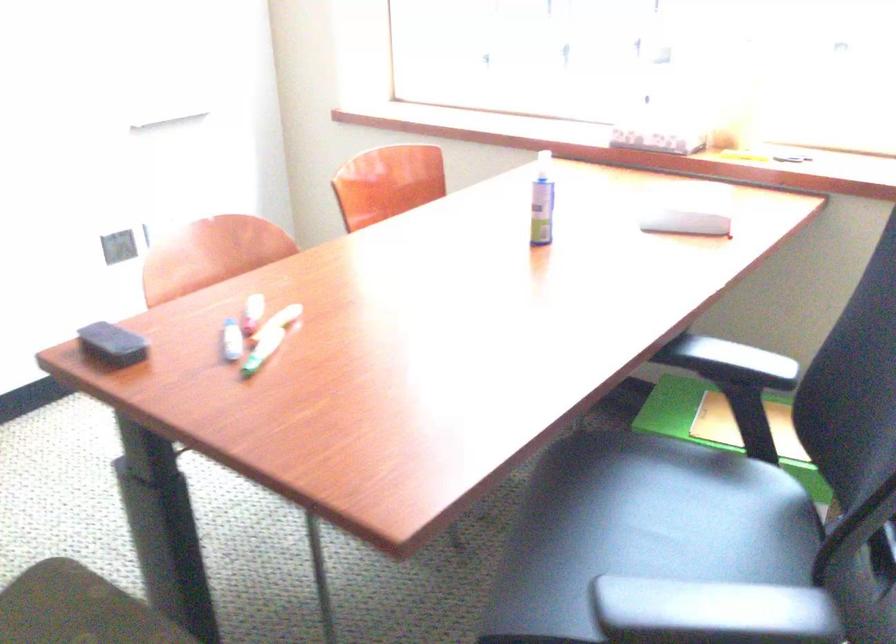
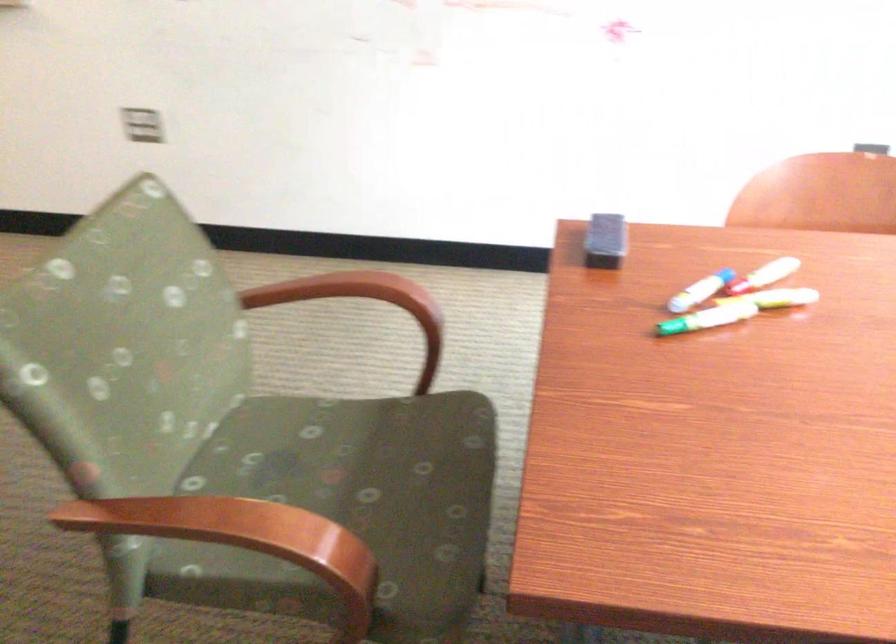
Find the pixel in the second image that matches the point at 238,335 in the first image.

(700, 290)